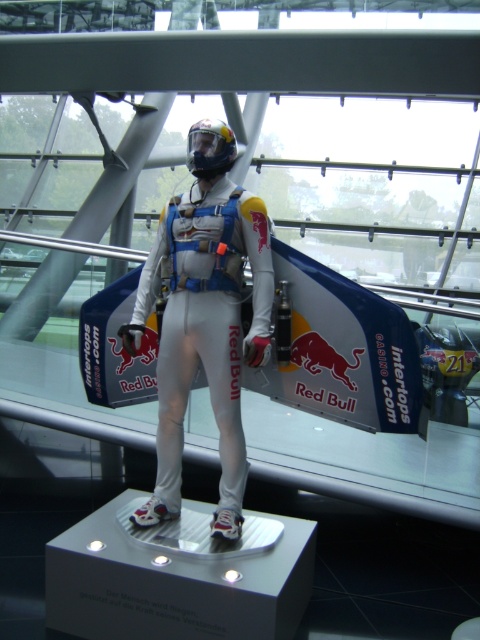
Question: Can you confirm if white matte suit at center is positioned above glossy plastic helmet at center?

Choices:
 (A) no
 (B) yes

Answer: (A)

Question: Which point is closer to the camera?

Choices:
 (A) [x=190, y=141]
 (B) [x=216, y=387]

Answer: (A)

Question: Is white matte suit at center closer to camera compared to glossy plastic helmet at center?

Choices:
 (A) yes
 (B) no

Answer: (B)

Question: Which object appears closest to the camera in this image?

Choices:
 (A) glossy plastic helmet at center
 (B) white matte suit at center

Answer: (A)

Question: Can you confirm if white matte suit at center is positioned above glossy plastic helmet at center?

Choices:
 (A) yes
 (B) no

Answer: (B)